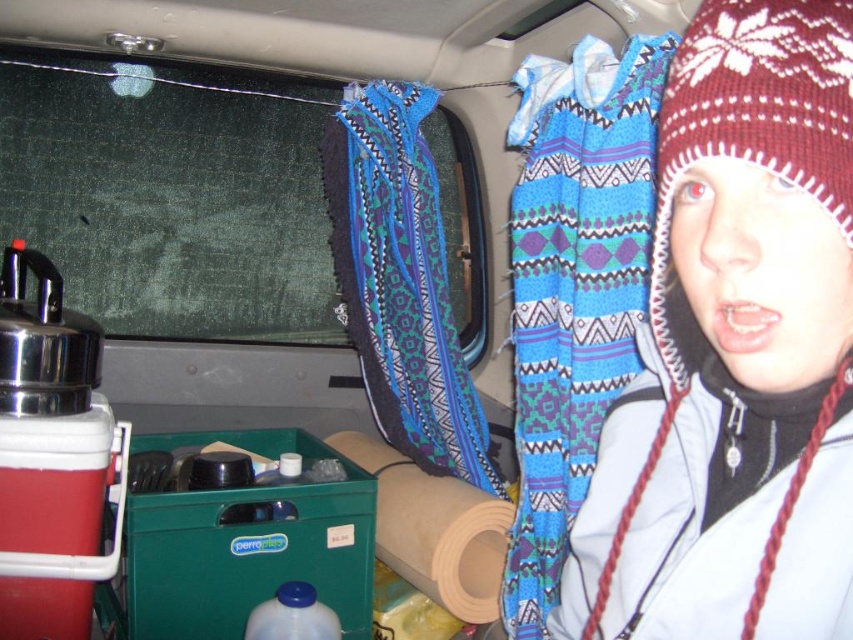
How distant is knitted woolen hat at upper right from blue woven blanket at center?

They are 4.09 feet apart.

Is knitted woolen hat at upper right further to camera compared to blue woven blanket at center?

No, knitted woolen hat at upper right is closer to the viewer.

Is point (584, 589) positioned in front of point (427, 376)?

Yes, it is.

You are a GUI agent. You are given a task and a screenshot of the screen. Output one action in this format:
    pyautogui.click(x=<x>, y=<y>)
    Task: Click on the knitted woolen hat at upper right
    
    Given the screenshot: What is the action you would take?
    pyautogui.click(x=735, y=353)

Who is taller, blue woven blanket at upper center or blue woven blanket at center?

blue woven blanket at upper center is taller.

Which is behind, point (515, 333) or point (370, 404)?

Point (370, 404)

The image size is (853, 640). In order to click on blue woven blanket at upper center in this screenshot , I will do `click(573, 285)`.

Is point (695, 260) positioned after point (582, 220)?

No.

Locate an element on the screen. The height and width of the screenshot is (640, 853). knitted woolen hat at upper right is located at coordinates (735, 353).